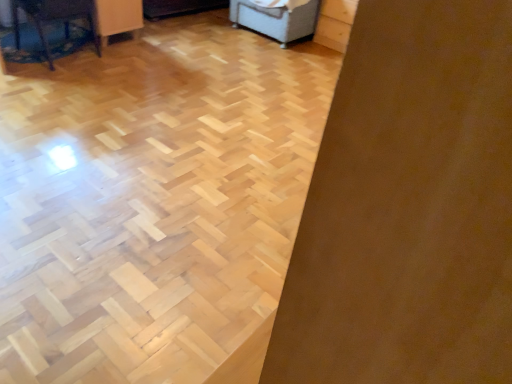
Question: Does point (88, 18) appear closer or farther from the camera than point (288, 16)?

Choices:
 (A) closer
 (B) farther

Answer: (A)

Question: Relative to light gray fabric ottoman at upper center, which is the 2th furniture from left to right, is wooden table at left, positioned as the 1th furniture in left-to-right order, in front or behind?

Choices:
 (A) behind
 (B) front

Answer: (B)

Question: In terms of height, does wooden table at left, arranged as the 2th furniture when viewed from the right, look taller or shorter compared to light gray fabric ottoman at upper center, placed as the first furniture when sorted from right to left?

Choices:
 (A) tall
 (B) short

Answer: (A)

Question: Is light gray fabric ottoman at upper center, placed as the first furniture when sorted from right to left, to the left or to the right of wooden table at left, arranged as the second furniture when viewed from the back, in the image?

Choices:
 (A) left
 (B) right

Answer: (B)

Question: From a real-world perspective, relative to wooden table at left, arranged as the second furniture when viewed from the back, is light gray fabric ottoman at upper center, acting as the second furniture starting from the front, vertically above or below?

Choices:
 (A) above
 (B) below

Answer: (B)

Question: Considering the positions of light gray fabric ottoman at upper center, acting as the second furniture starting from the front, and wooden table at left, arranged as the 2th furniture when viewed from the right, in the image, is light gray fabric ottoman at upper center, acting as the second furniture starting from the front, wider or thinner than wooden table at left, arranged as the 2th furniture when viewed from the right,?

Choices:
 (A) thin
 (B) wide

Answer: (B)

Question: In the image, is light gray fabric ottoman at upper center, which is the 2th furniture from left to right, positioned in front of or behind wooden table at left, arranged as the 2th furniture when viewed from the right?

Choices:
 (A) behind
 (B) front

Answer: (A)